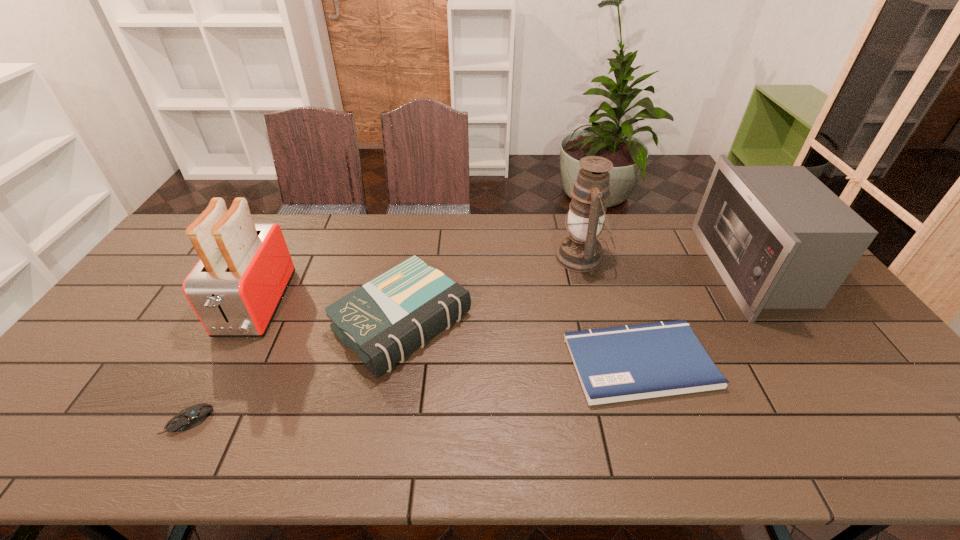
Locate an element on the screen. The height and width of the screenshot is (540, 960). vacant region at the far edge of the desktop is located at coordinates pos(524,237).

In the image, there is a desktop. At what (x,y) coordinates should I click in order to perform the action: click on vacant space at the near edge. Please return your answer as a coordinate pair (x, y). The width and height of the screenshot is (960, 540). Looking at the image, I should click on click(737, 450).

The width and height of the screenshot is (960, 540). I want to click on free space at the left edge of the desktop, so click(87, 383).

This screenshot has height=540, width=960. In the image, there is a desktop. Identify the location of blank space at the right edge. (809, 340).

Where is `vacant area that lies between the rightmost object and the toaster`? This screenshot has width=960, height=540. vacant area that lies between the rightmost object and the toaster is located at coordinates (504, 287).

Find the location of a particular element. vacant area between the third shortest object and the shorter paperback book is located at coordinates (521, 342).

This screenshot has height=540, width=960. What are the coordinates of `empty space between the taller paperback book and the oil lamp` in the screenshot? It's located at (492, 290).

The width and height of the screenshot is (960, 540). I want to click on free space between the shorter paperback book and the left paperback book, so click(x=521, y=342).

The width and height of the screenshot is (960, 540). Identify the location of unoccupied position between the computer mouse and the shorter paperback book. click(414, 392).

At what (x,y) coordinates should I click in order to perform the action: click on vacant space that is in between the right paperback book and the toaster. Please return your answer as a coordinate pair (x, y). The height and width of the screenshot is (540, 960). Looking at the image, I should click on (447, 334).